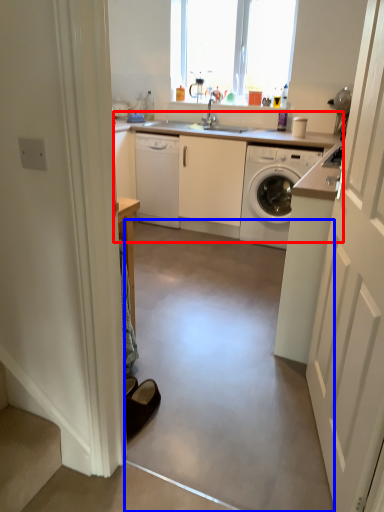
Question: Which of the following is the farthest to the observer, counter top (highlighted by a red box) or concrete (highlighted by a blue box)?

Choices:
 (A) counter top
 (B) concrete

Answer: (A)